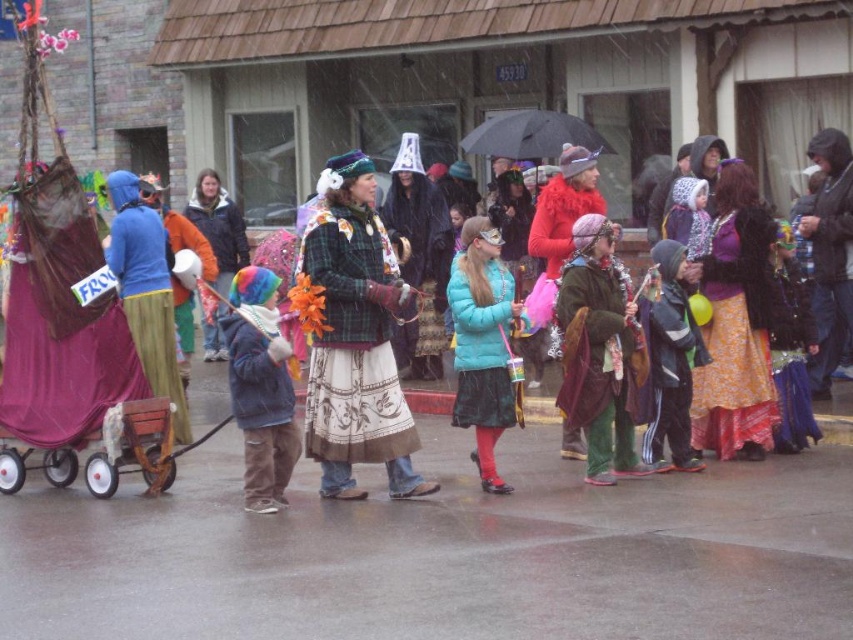
You are a photographer at the event and want to capture both the orange floral skirt at center and the orange fleece jacket at center in the same frame. Which object should you position closer to the left side of your camera viewfinder to include both?

To include both the orange floral skirt at center and the orange fleece jacket at center in the same frame, position the orange fleece jacket at center closer to the left side of your camera viewfinder since the orange floral skirt at center is to the right of it.

You are a photographer trying to capture both the velvet green robe at center and the dark gray fleece jacket at center in a single frame. Given their sizes, which one should you focus on to ensure both are visible without cropping?

The velvet green robe at center is bigger than the dark gray fleece jacket at center, so you should focus on the velvet green robe at center to ensure both are visible without cropping.